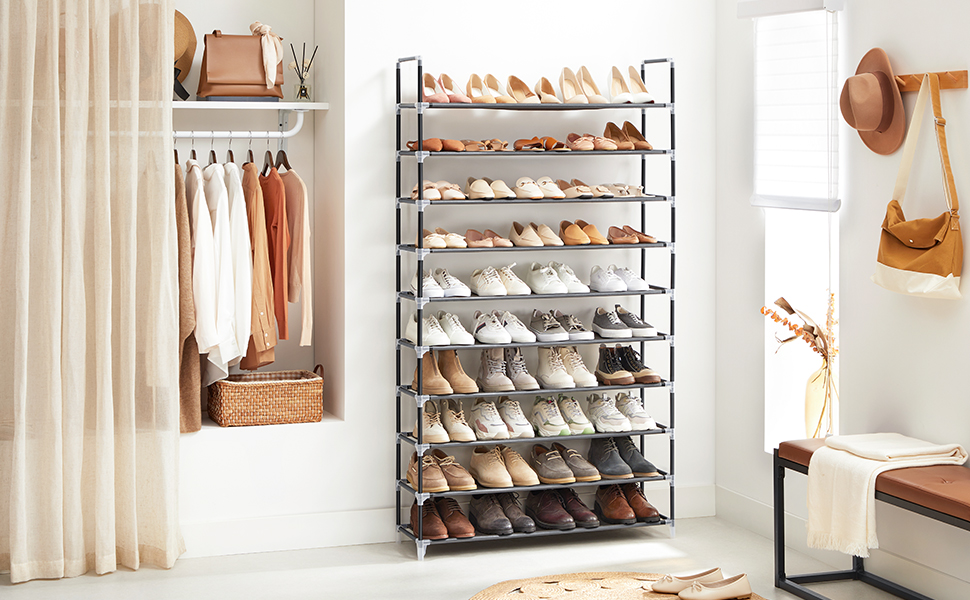
Where is `top shelf of shoe rack`? Image resolution: width=970 pixels, height=600 pixels. top shelf of shoe rack is located at coordinates (435, 93), (461, 95), (483, 95), (503, 95), (526, 95), (551, 95), (570, 95), (595, 96), (618, 90), (637, 83).